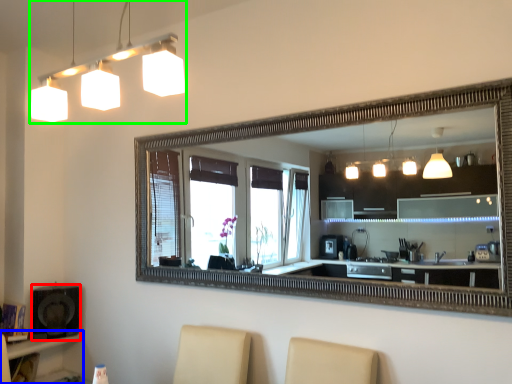
Question: Which is nearer to the speaker (highlighted by a red box)? vanity (highlighted by a blue box) or lamp (highlighted by a green box).

Choices:
 (A) vanity
 (B) lamp

Answer: (A)